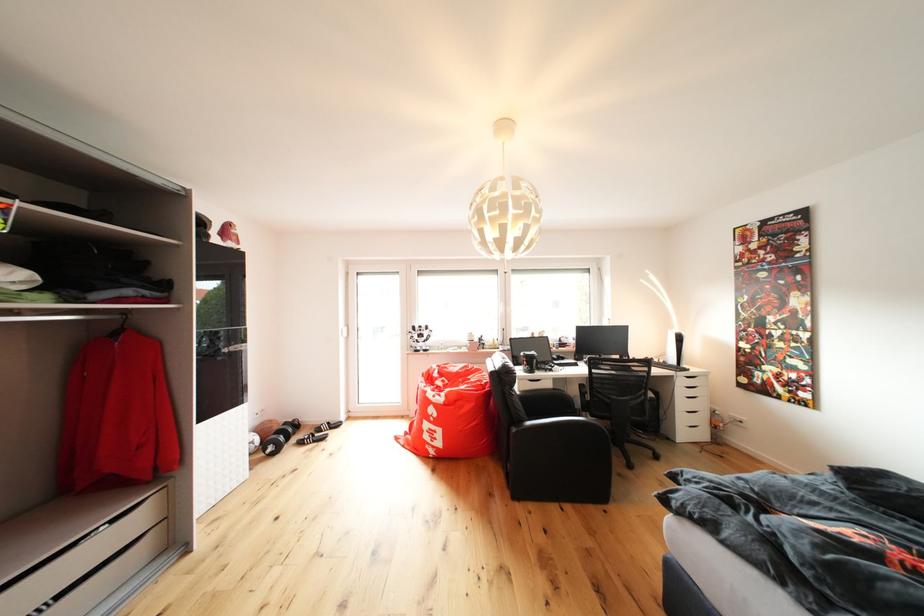
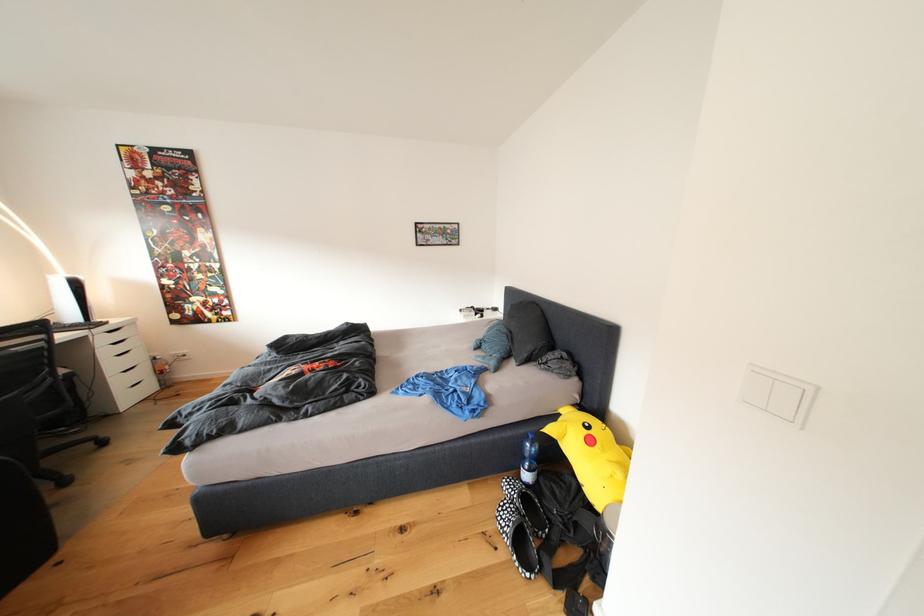
The point at (654, 399) is marked in the first image. Where is the corresponding point in the second image?

(63, 378)